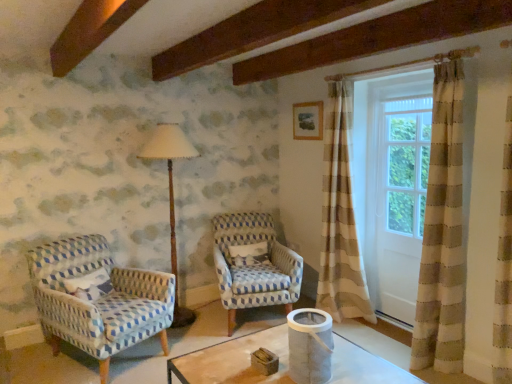
What are the coordinates of `vacant space in blue-patterned fabric chair at left, acting as the 2th chair starting from the right (from a real-world perspective)` in the screenshot? It's located at (114, 365).